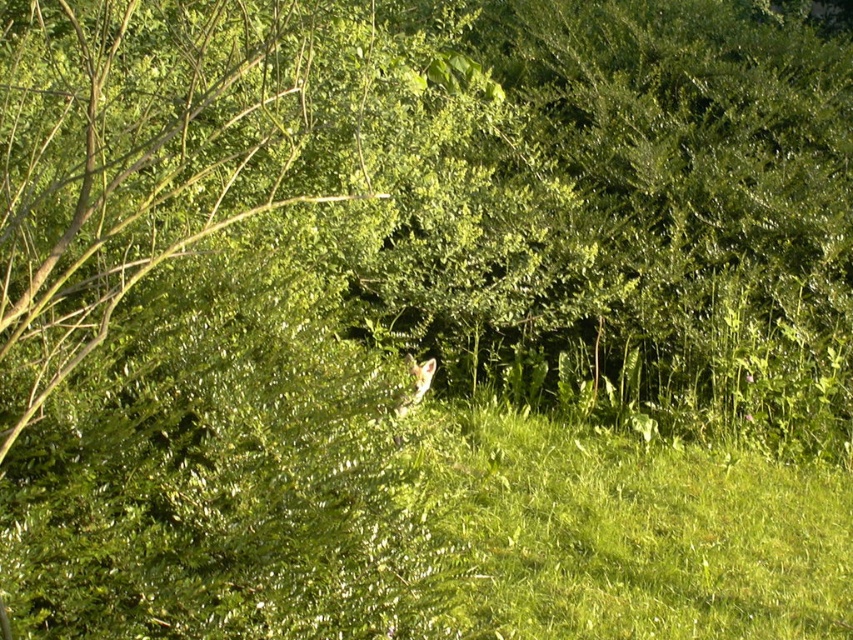
You are a photographer aiming to capture a clear shot of the white fur fox at center without the green leafy tree at center blocking it. Based on the scene, is it possible to adjust your position to achieve this?

The green leafy tree at center is located above the white fur fox at center, so if you move your camera position lower or shift sideways, you can avoid the tree blocking the fox.

You are a photographer aiming to capture the white fur fox at center in your shot. Given that the green grassy at center is much taller than the fox, will the fox be fully visible in the frame?

The green grassy at center is much taller than the white fur fox at center, so the fox may be partially obscured by the grass. Adjust your angle or position to ensure the fox is fully visible.